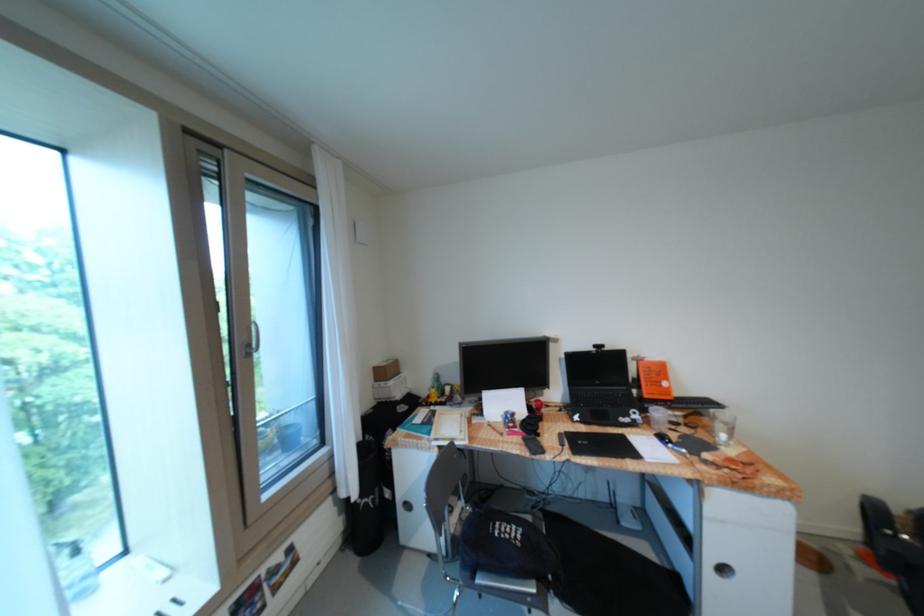
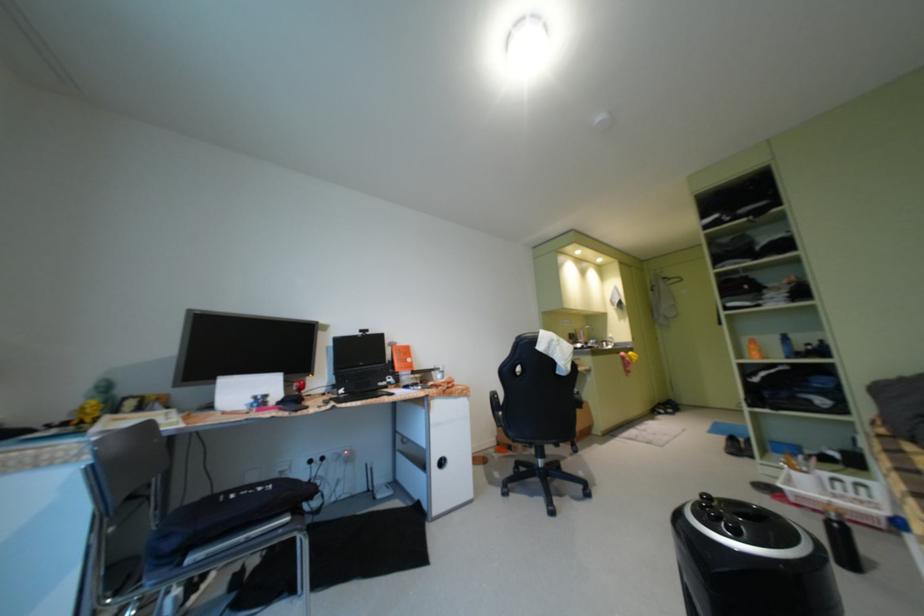
First-person continuous shooting, in which direction is the camera rotating?

The camera's rotation is toward right-up.